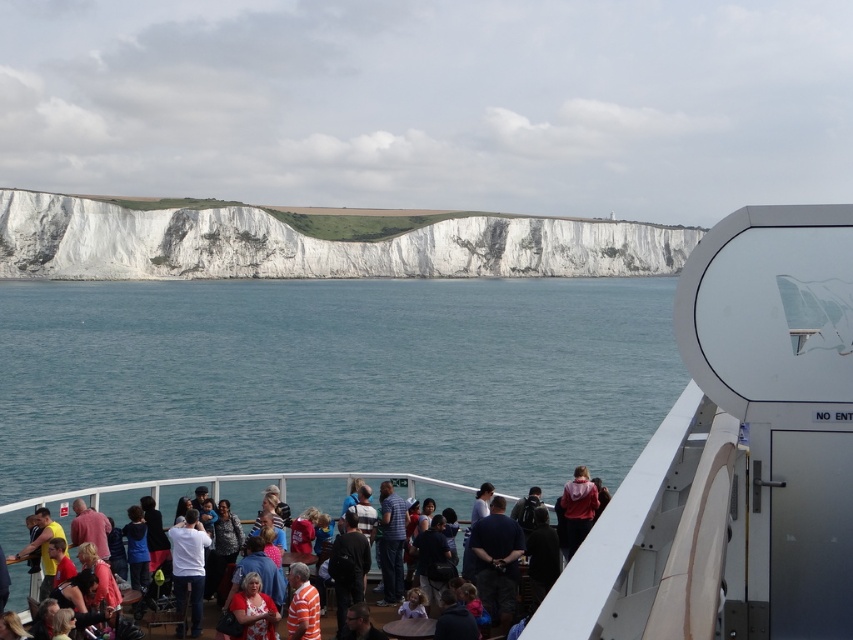
Question: Is matte red dress at lower center positioned before red hoodie at center?

Choices:
 (A) no
 (B) yes

Answer: (B)

Question: Is matte red dress at lower center thinner than red hoodie at center?

Choices:
 (A) yes
 (B) no

Answer: (B)

Question: Considering the real-world distances, which object is farthest from the white matte boat at center?

Choices:
 (A) multicolored casual clothing at center
 (B) red hoodie at center

Answer: (B)

Question: Is white matte boat at center to the right of white smooth cliff at center from the viewer's perspective?

Choices:
 (A) no
 (B) yes

Answer: (A)

Question: Which object is positioned farthest from the multicolored casual clothing at center?

Choices:
 (A) white matte boat at center
 (B) matte red dress at lower center
 (C) red hoodie at center

Answer: (C)

Question: Which is farther from the multicolored casual clothing at center?

Choices:
 (A) white smooth cliff at center
 (B) white matte boat at center

Answer: (A)